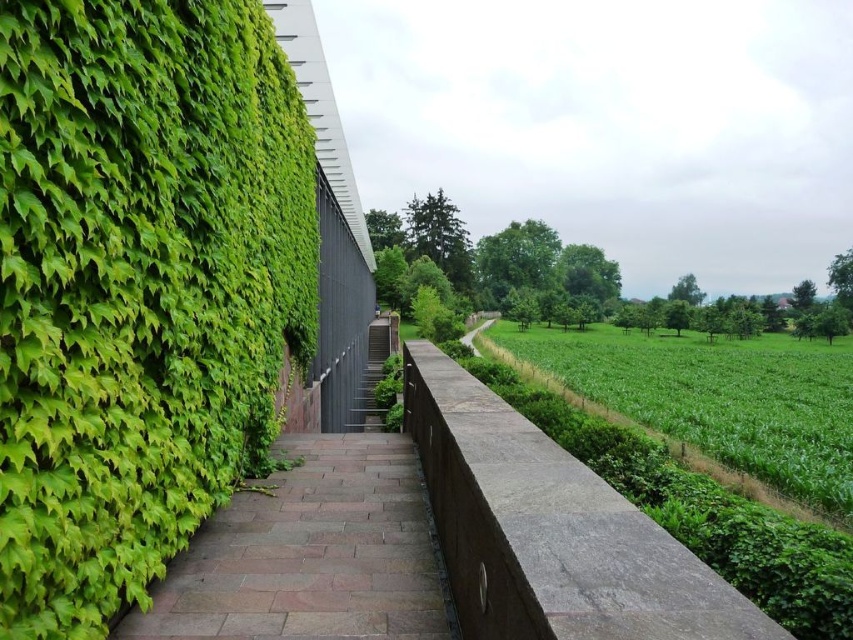
Question: Can you confirm if green leafy hedge at left is bigger than brown stone path at center?

Choices:
 (A) yes
 (B) no

Answer: (B)

Question: Is green leafy hedge at left closer to camera compared to brown stone path at center?

Choices:
 (A) no
 (B) yes

Answer: (B)

Question: Can you confirm if green leafy hedge at left is bigger than brown stone path at center?

Choices:
 (A) yes
 (B) no

Answer: (B)

Question: Which point appears farthest from the camera in this image?

Choices:
 (A) (279, 497)
 (B) (347, 429)
 (C) (277, 348)

Answer: (B)

Question: Which of the following is the closest to the observer?

Choices:
 (A) (379, 410)
 (B) (65, 582)

Answer: (B)

Question: Among these points, which one is farthest from the camera?

Choices:
 (A) (280, 481)
 (B) (370, 397)
 (C) (221, 266)

Answer: (B)